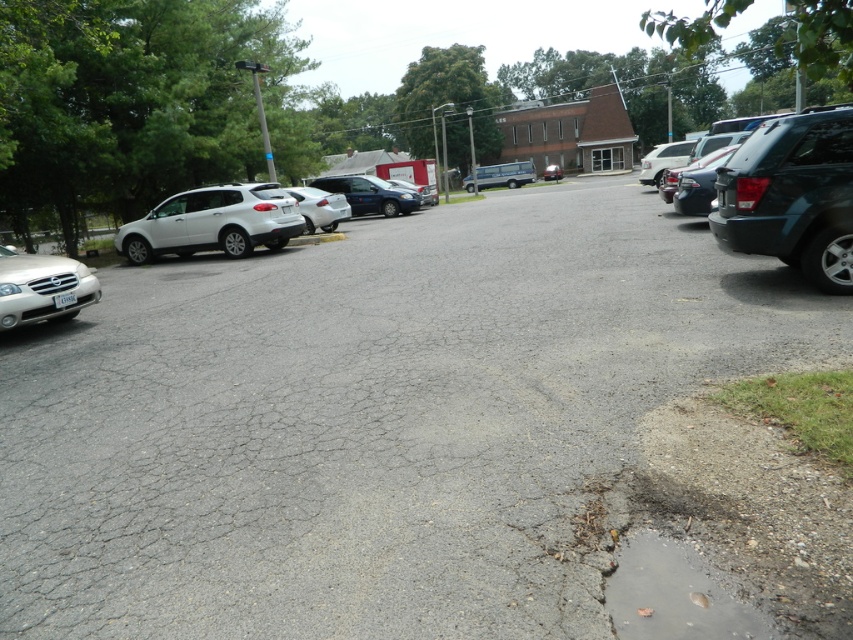
Question: Is clear asphalt puddle at lower right bigger than satin white suv at left?

Choices:
 (A) yes
 (B) no

Answer: (B)

Question: Which object appears closest to the camera in this image?

Choices:
 (A) satin silver sedan at center
 (B) asphalt at center
 (C) satin white suv at left

Answer: (B)

Question: Is asphalt at center positioned before matte silver van at center?

Choices:
 (A) yes
 (B) no

Answer: (A)

Question: Which object is the closest to the matte silver van at center?

Choices:
 (A) satin silver sedan at center
 (B) clear asphalt puddle at lower right

Answer: (A)

Question: Which object is farther from the camera taking this photo?

Choices:
 (A) satin blue sedan at center
 (B) asphalt at center
 (C) clear asphalt puddle at lower right
 (D) satin silver sedan at center

Answer: (A)

Question: Is asphalt at center to the right of clear asphalt puddle at lower right from the viewer's perspective?

Choices:
 (A) no
 (B) yes

Answer: (A)